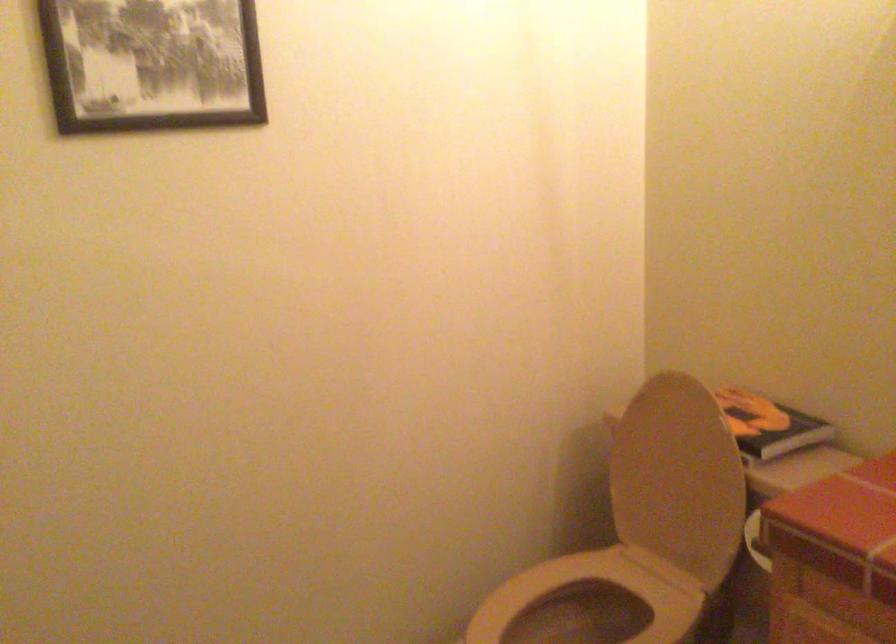
Identify the location of black cover book. (769, 426).